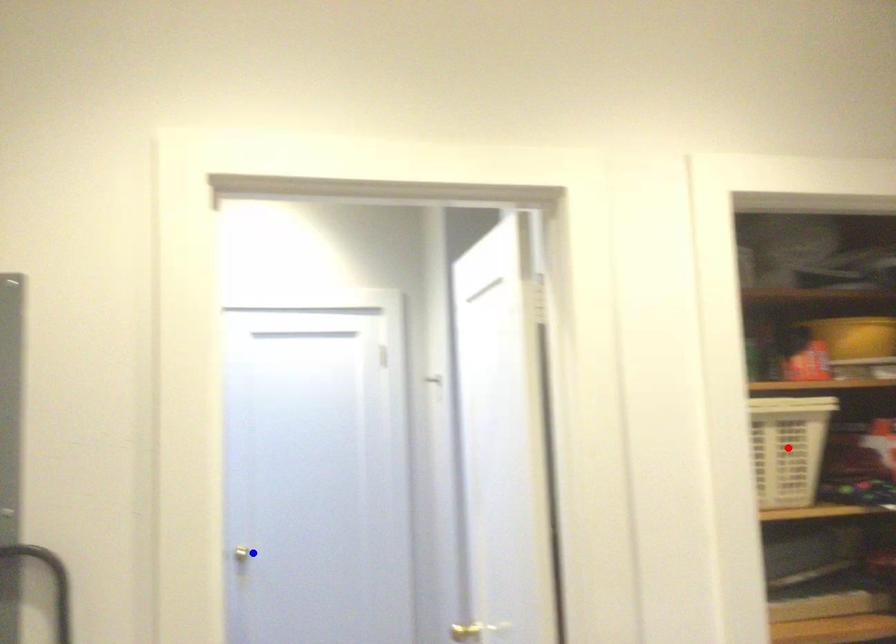
Question: In the image, two points are highlighted. Which point is nearer to the camera? Reply with the corresponding letter.

Choices:
 (A) blue point
 (B) red point

Answer: (B)